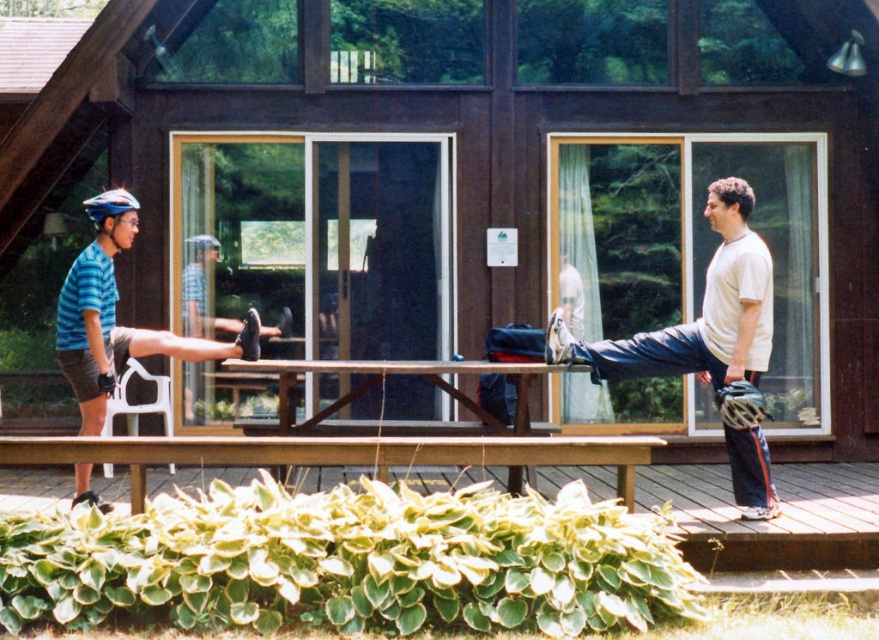
Is point (59, 460) closer to viewer compared to point (169, 346)?

Yes, it is.

The width and height of the screenshot is (879, 640). I want to click on wooden bench at lower center, so [x=549, y=465].

Is point (636, 440) positioned after point (62, 362)?

That is False.

Locate an element on the screen. This screenshot has width=879, height=640. wooden bench at lower center is located at coordinates (549, 465).

Which is more to the left, blue helmeted skateboarder at left or wooden picnic table at center?

Positioned to the left is blue helmeted skateboarder at left.

Identify the location of blue helmeted skateboarder at left. (114, 316).

Measure the distance between point (137, 209) and camera.

Point (137, 209) is 8.50 meters from camera.

Where is `blue helmeted skateboarder at left`? blue helmeted skateboarder at left is located at coordinates (114, 316).

I want to click on wooden bench at lower center, so click(x=549, y=465).

Is wooden bench at lower center to the right of wooden picnic table at center from the viewer's perspective?

Correct, you'll find wooden bench at lower center to the right of wooden picnic table at center.

Find the location of a particular element. The width and height of the screenshot is (879, 640). wooden bench at lower center is located at coordinates (549, 465).

Locate an element on the screen. wooden bench at lower center is located at coordinates (549, 465).